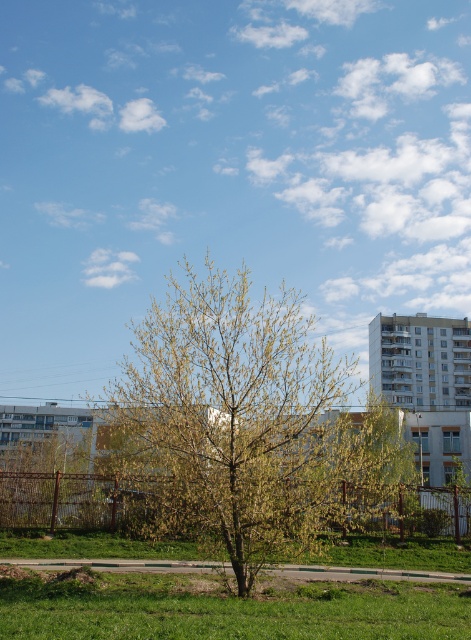
Does green leafy tree at center appear over green grassy at lower center?

Yes.

Based on the photo, can you confirm if green leafy tree at center is positioned to the left of green grassy at lower center?

Correct, you'll find green leafy tree at center to the left of green grassy at lower center.

Between point (299, 339) and point (452, 611), which one is positioned behind?

Positioned behind is point (299, 339).

Image resolution: width=471 pixels, height=640 pixels. I want to click on green leafy tree at center, so click(243, 420).